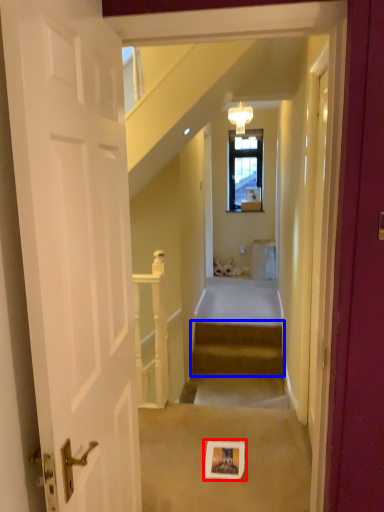
Question: Which point is closer to the camera, picture frame (highlighted by a red box) or stairs (highlighted by a blue box)?

Choices:
 (A) picture frame
 (B) stairs

Answer: (A)